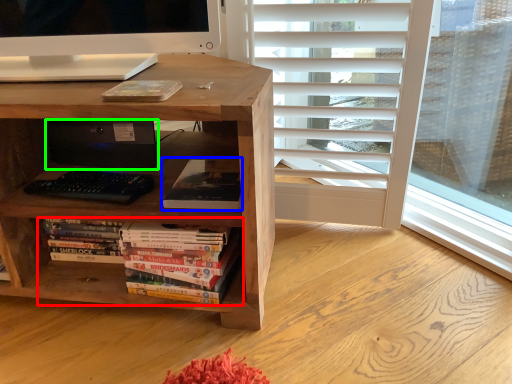
Question: Estimate the real-world distances between objects in this image. Which object is closer to book (highlighted by a red box), book (highlighted by a blue box) or computer (highlighted by a green box)?

Choices:
 (A) book
 (B) computer

Answer: (A)